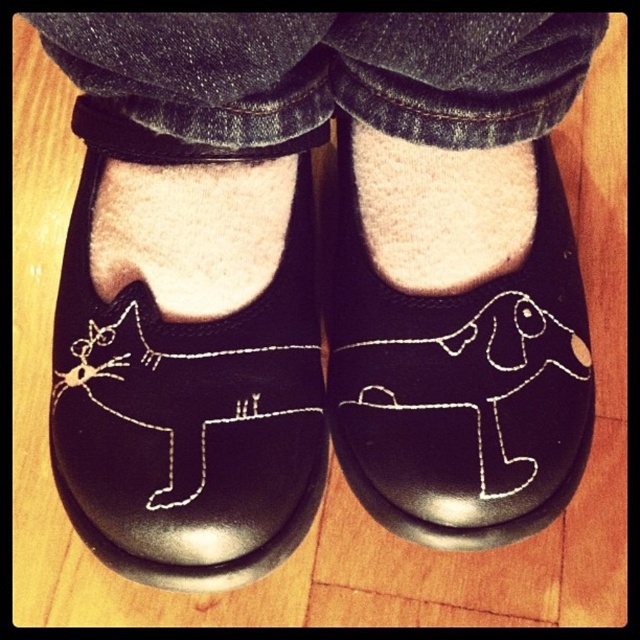
Question: Which point is closer to the camera?

Choices:
 (A) black leather dog at center
 (B) black leather cat at center

Answer: (B)

Question: Is black leather dog at center wider than white fluffy sock at center?

Choices:
 (A) no
 (B) yes

Answer: (B)

Question: Estimate the real-world distances between objects in this image. Which object is closer to the black leather cat at center?

Choices:
 (A) white fluffy sock at center
 (B) black leather dog at center

Answer: (B)

Question: Considering the real-world distances, which object is farthest from the black leather dog at center?

Choices:
 (A) white fluffy sock at center
 (B) black leather cat at center

Answer: (B)

Question: Is black leather cat at center smaller than white fluffy sock at center?

Choices:
 (A) no
 (B) yes

Answer: (A)

Question: In this image, where is black leather cat at center located relative to white fluffy sock at center?

Choices:
 (A) below
 (B) above

Answer: (A)